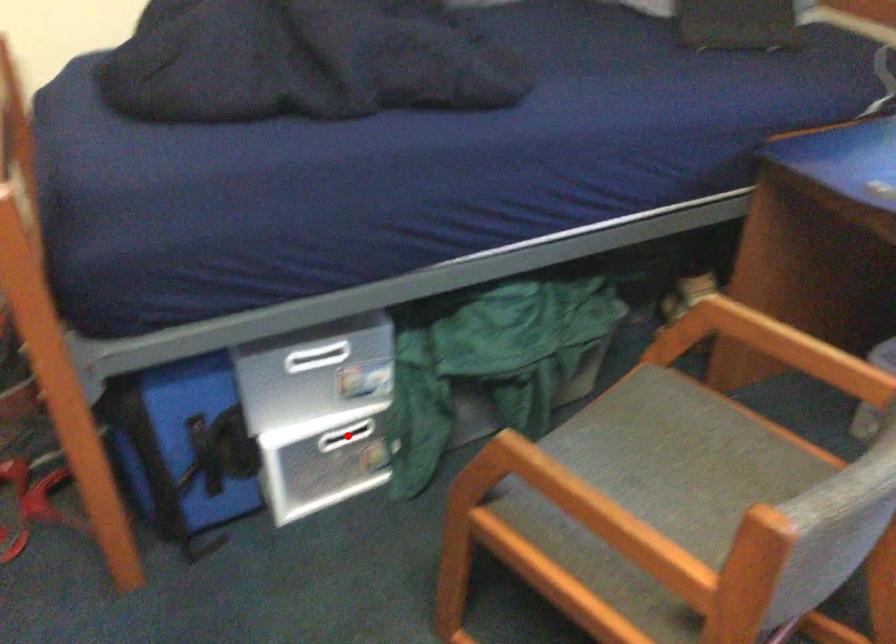
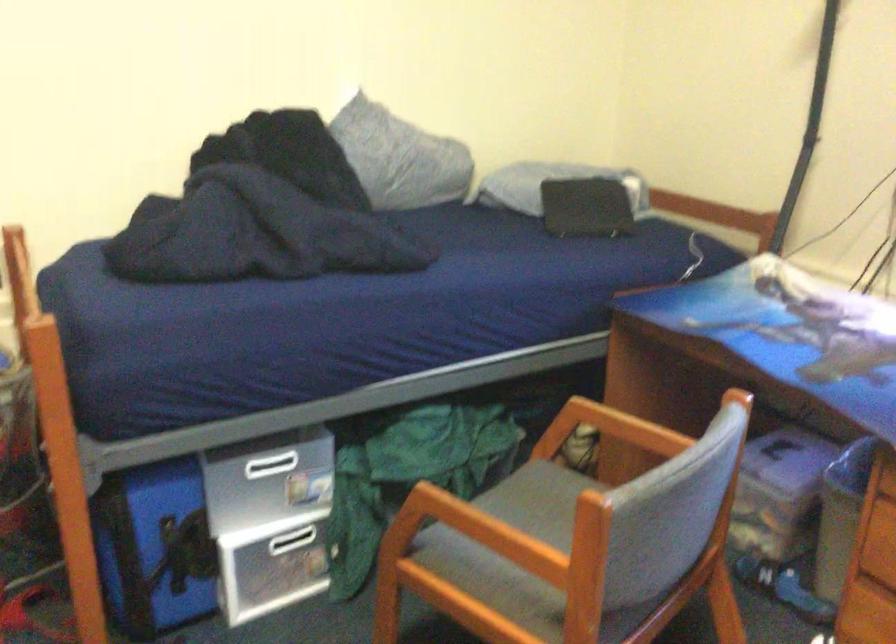
Question: I am providing you with two images of the same scene from different viewpoints. Image1 has a red point marked. In image2, the corresponding 3D location appears at what relative position? Reply with the corresponding letter.

Choices:
 (A) Closer
 (B) Farther

Answer: (B)